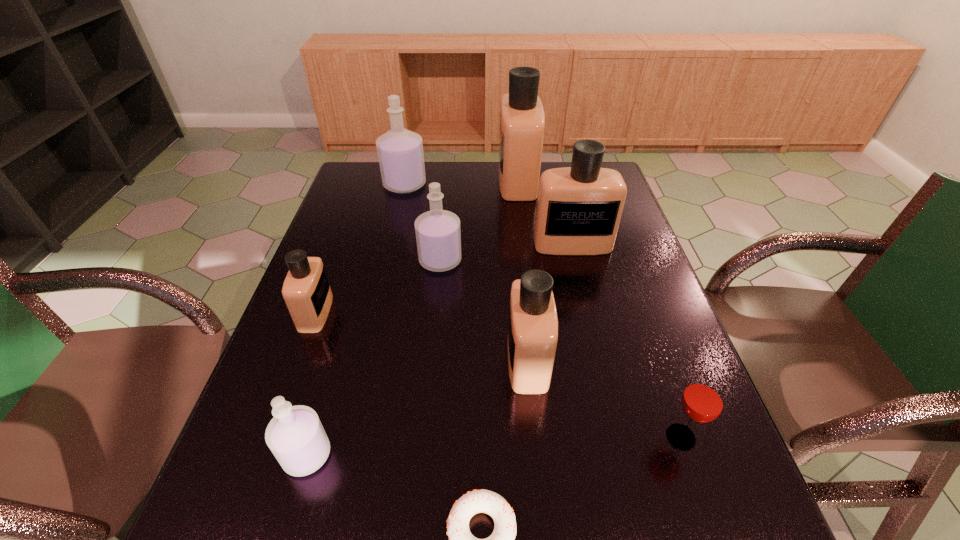
Select which purple perfume is the third closest to the glass. Please provide its 2D coordinates. Your answer should be formatted as a tuple, i.e. [(x, y)], where the tuple contains the x and y coordinates of a point satisfying the conditions above.

[(400, 153)]

Identify which purple perfume is the second closest to the nearest perfume. Please provide its 2D coordinates. Your answer should be formatted as a tuple, i.e. [(x, y)], where the tuple contains the x and y coordinates of a point satisfying the conditions above.

[(400, 153)]

In order to click on free point that satisfies the following two spatial constraints: 1. on the front label of the red glass; 2. on the left side of the biggest beige perfume in this screenshot , I will do (x=548, y=437).

Locate an element on the screen. free space that satisfies the following two spatial constraints: 1. on the front label of the tallest perfume; 2. on the front side of the fourth perfume from right to left is located at coordinates (527, 260).

I want to click on free space that satisfies the following two spatial constraints: 1. on the front label of the tallest perfume; 2. on the left side of the red glass, so click(x=548, y=437).

Identify the location of vacant point that satisfies the following two spatial constraints: 1. on the front side of the biggest purple perfume; 2. on the front label of the leftmost beige perfume. 374,313.

Image resolution: width=960 pixels, height=540 pixels. What are the coordinates of `free space that satisfies the following two spatial constraints: 1. on the front label of the glass; 2. on the right side of the tallest perfume` in the screenshot? It's located at pos(548,437).

Identify the location of vacant point that satisfies the following two spatial constraints: 1. on the front label of the smallest beige perfume; 2. on the back side of the nearest perfume. (264, 455).